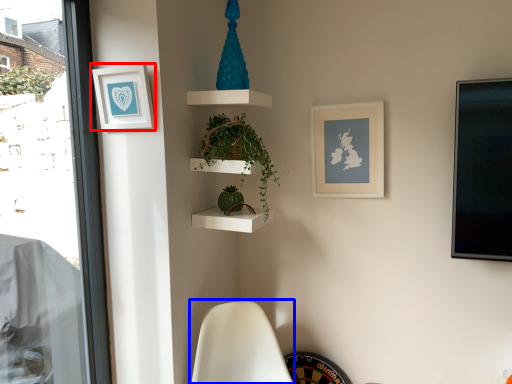
Question: Among these objects, which one is nearest to the camera, picture frame (highlighted by a red box) or swivel chair (highlighted by a blue box)?

Choices:
 (A) picture frame
 (B) swivel chair

Answer: (B)